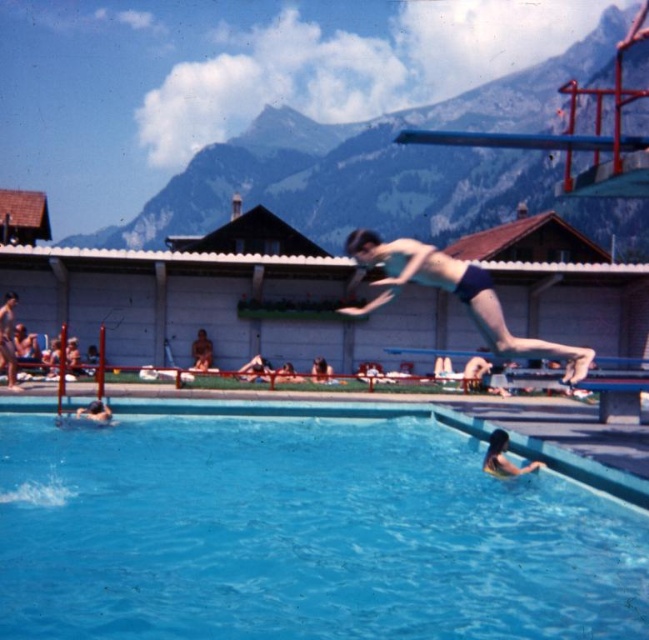
Is smooth skin person at lower right thinner than smooth skin diver at center?

No.

Between point (530, 468) and point (10, 380), which one is positioned behind?

The point (10, 380) is more distant.

Between point (498, 451) and point (12, 358), which one is positioned in front?

Point (498, 451) is in front.

Locate an element on the screen. This screenshot has height=640, width=649. smooth skin person at lower right is located at coordinates (504, 458).

Does blue smooth water at center have a lesser width compared to smooth skin diver at center?

No.

Between point (633, 536) and point (5, 342), which one is positioned in front?

Point (633, 536)

Find the location of a particular element. Image resolution: width=649 pixels, height=640 pixels. blue smooth water at center is located at coordinates (302, 532).

Identify the location of blue smooth water at center. This screenshot has width=649, height=640. (302, 532).

From the picture: Between smooth skin diver at center and smooth skin person at center, which one appears on the right side from the viewer's perspective?

smooth skin person at center

Between smooth skin diver at center and smooth skin person at center, which one appears on the left side from the viewer's perspective?

From the viewer's perspective, smooth skin diver at center appears more on the left side.

Image resolution: width=649 pixels, height=640 pixels. I want to click on smooth skin diver at center, so click(x=6, y=339).

What are the coordinates of `smooth skin diver at center` in the screenshot? It's located at (6, 339).